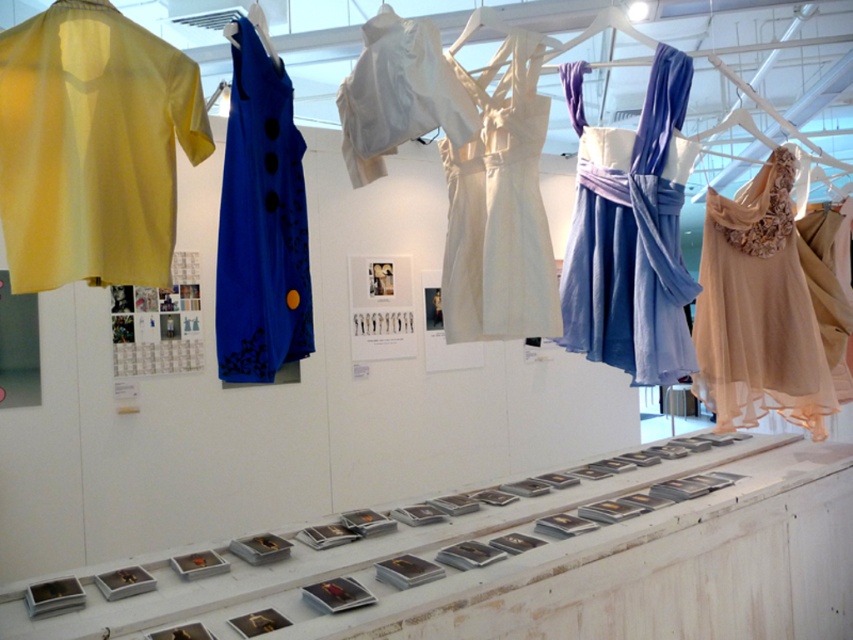
Who is positioned more to the right, beige chiffon dress at right or satin blue dress at center?

beige chiffon dress at right is more to the right.

Is point (822, 416) positioned behind point (675, 294)?

Yes, it is behind point (675, 294).

Is point (776, 349) positioned in front of point (663, 196)?

No, it is not.

You are a GUI agent. You are given a task and a screenshot of the screen. Output one action in this format:
    pyautogui.click(x=<x>, y=<y>)
    Task: Click on the beige chiffon dress at right
    
    Given the screenshot: What is the action you would take?
    pyautogui.click(x=758, y=308)

Between beige chiffon dress at right and ivory satin dress at center, which one has less height?

ivory satin dress at center

Is the position of beige chiffon dress at right less distant than that of ivory satin dress at center?

No, it is behind ivory satin dress at center.

Does point (726, 284) come in front of point (532, 307)?

No, it is behind (532, 307).

Locate an element on the screen. beige chiffon dress at right is located at coordinates tap(758, 308).

Is blue satin dress at center below beige chiffon dress at right?

Actually, blue satin dress at center is above beige chiffon dress at right.

Who is higher up, blue satin dress at center or beige chiffon dress at right?

Positioned higher is blue satin dress at center.

Between point (292, 145) and point (757, 188), which one is positioned behind?

The point (757, 188) is behind.

In order to click on blue satin dress at center in this screenshot , I will do pos(260,218).